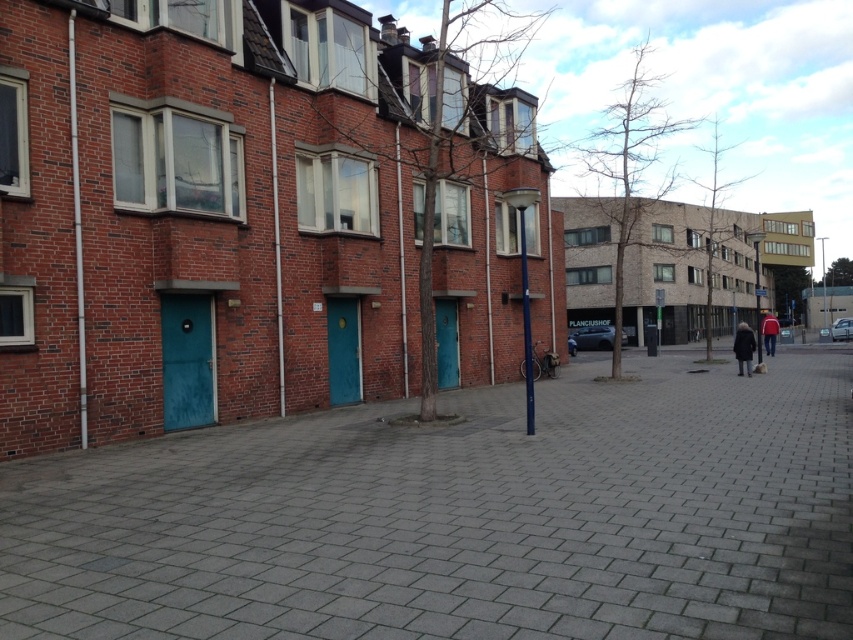
You are standing at the center of the paved area in the urban street scene. You want to place a new bench exactly 0.3 units to the right of the dark gray coat at lower right. What are the coordinates where the bench should be placed?

The dark gray coat at lower right is located at coordinates point (x=743, y=348). Adding 0.3 units to the x coordinate gives 0.544 0.3 0.844. The bench should be placed at coordinates point (x=743, y=540).

You are standing on the gray concrete pavement at center and want to pick up the dark gray coat at lower right. In which direction should you move to reach it?

The gray concrete pavement at center is positioned on the left side of the dark gray coat at lower right, so you should move to the right to reach it.

You are a delivery person who needs to place a small package on the paved area in the foreground. You have two options for placement near the dark gray coat at lower right and the red fabric jacket at right. Which location would allow the package to fit better without overlapping either item?

The dark gray coat at lower right occupies less space than the red fabric jacket at right, so placing the package near the dark gray coat at lower right would leave more space and prevent overlapping.